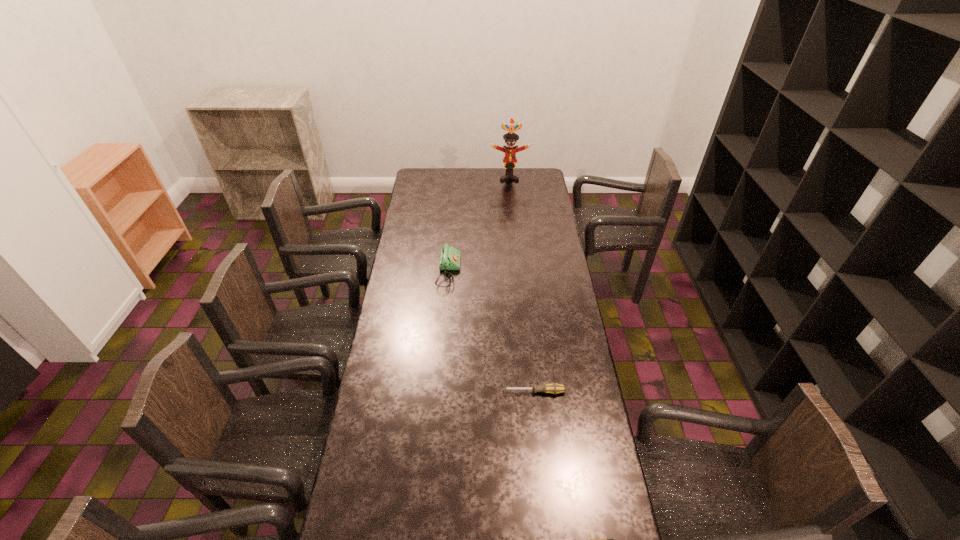
The width and height of the screenshot is (960, 540). Find the location of `vacant space located at the tip of the second shortest object`. vacant space located at the tip of the second shortest object is located at coordinates (425, 392).

This screenshot has width=960, height=540. I want to click on object situated at the far edge, so click(x=509, y=161).

Identify the location of nutcracker present at the right edge. The image size is (960, 540). [509, 161].

I want to click on screwdriver present at the right edge, so click(554, 388).

Identify the location of object present at the far right corner. The height and width of the screenshot is (540, 960). (509, 161).

The height and width of the screenshot is (540, 960). I want to click on free space at the far edge, so click(470, 190).

In the image, there is a desktop. Where is `vacant space at the left edge`? This screenshot has width=960, height=540. vacant space at the left edge is located at coordinates tap(389, 437).

Where is `vacant region at the right edge`? The width and height of the screenshot is (960, 540). vacant region at the right edge is located at coordinates (580, 505).

Find the location of `vacant space that is in between the second tallest object and the third farthest object`. vacant space that is in between the second tallest object and the third farthest object is located at coordinates (492, 332).

Where is `vacant area that lies between the nutcracker and the leftmost object`? This screenshot has height=540, width=960. vacant area that lies between the nutcracker and the leftmost object is located at coordinates tap(479, 225).